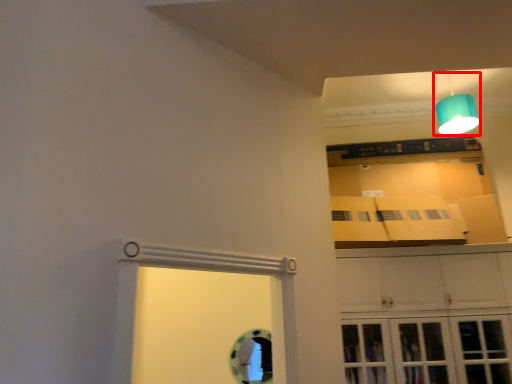
Question: From the image's perspective, what is the correct spatial relationship of lamp (annotated by the red box) in relation to cabinetry?

Choices:
 (A) above
 (B) below

Answer: (A)